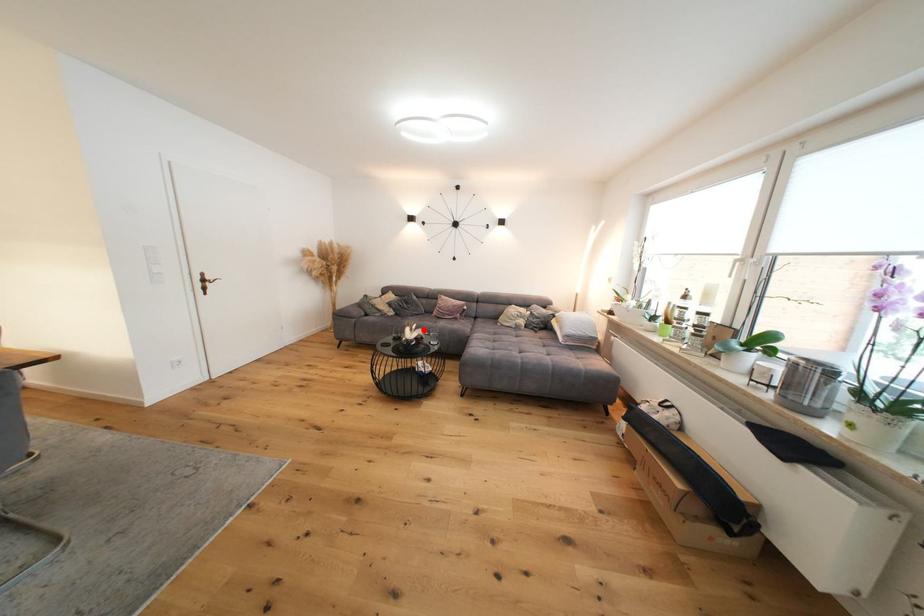
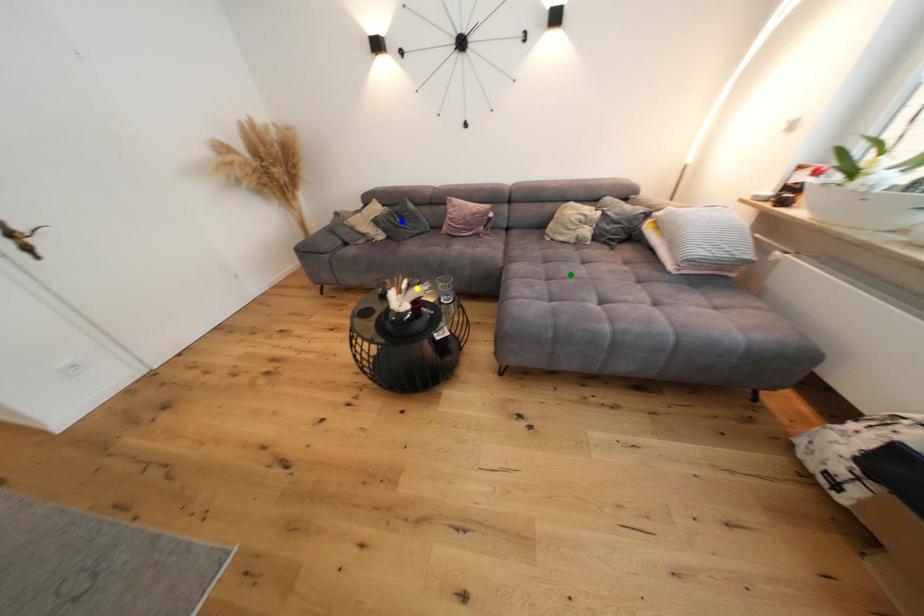
Question: I am providing you with two images of the same scene from different viewpoints. A red point is marked on the first image. You are given multiple points on the second image. Which mark in image 2 goes with the point in image 1?

Choices:
 (A) yellow point
 (B) blue point
 (C) green point

Answer: (A)